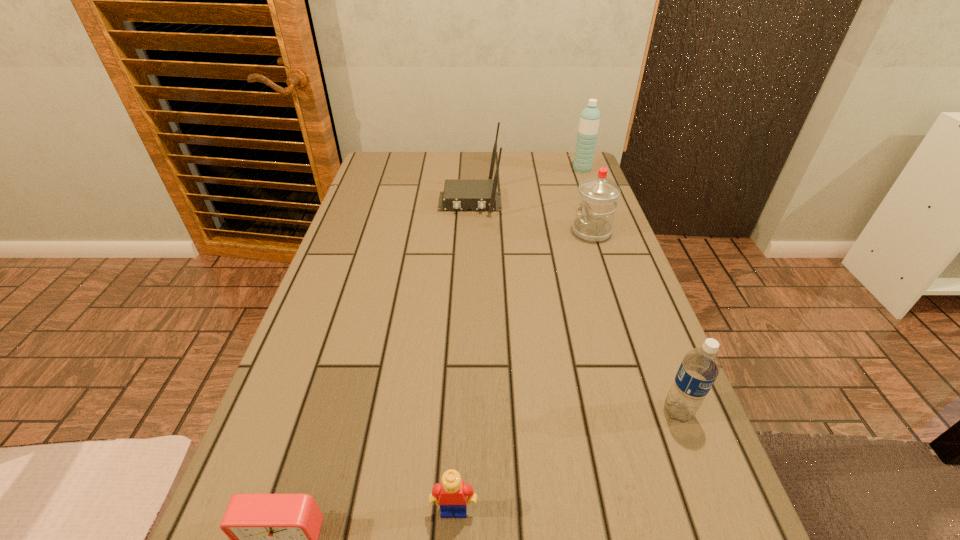
Locate an element on the screen. the farthest water bottle is located at coordinates (589, 121).

The height and width of the screenshot is (540, 960). I want to click on the tallest water bottle, so click(x=589, y=121).

Where is `router`? router is located at coordinates (459, 194).

Where is `the second farthest water bottle`? Image resolution: width=960 pixels, height=540 pixels. the second farthest water bottle is located at coordinates [598, 196].

At what (x,y) coordinates should I click in order to perform the action: click on the third nearest object. Please return your answer as a coordinate pair (x, y). This screenshot has width=960, height=540. Looking at the image, I should click on pos(700,367).

What are the coordinates of `the second shortest object` in the screenshot? It's located at (452, 491).

Where is `free space located 0.190m on the left of the farthest water bottle`? The width and height of the screenshot is (960, 540). free space located 0.190m on the left of the farthest water bottle is located at coordinates (516, 170).

Image resolution: width=960 pixels, height=540 pixels. I want to click on vacant space located 0.080m on the back of the fifth nearest object to connect cables, so click(468, 234).

Locate an element on the screen. This screenshot has width=960, height=540. vacant space located on the handle side of the second nearest water bottle is located at coordinates (471, 232).

In order to click on vacant space positioned 0.370m on the handle side of the second nearest water bottle in this screenshot , I will do `click(439, 232)`.